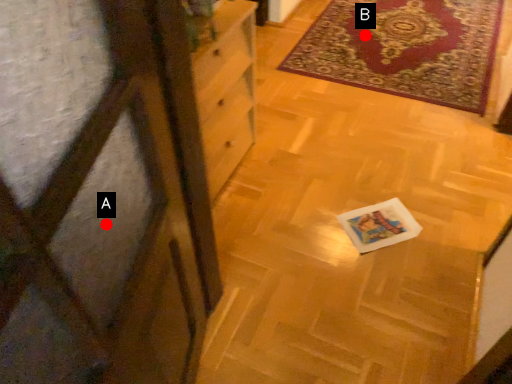
Question: Two points are circled on the image, labeled by A and B beside each circle. Which of the following is the closest to the observer?

Choices:
 (A) A is closer
 (B) B is closer

Answer: (A)